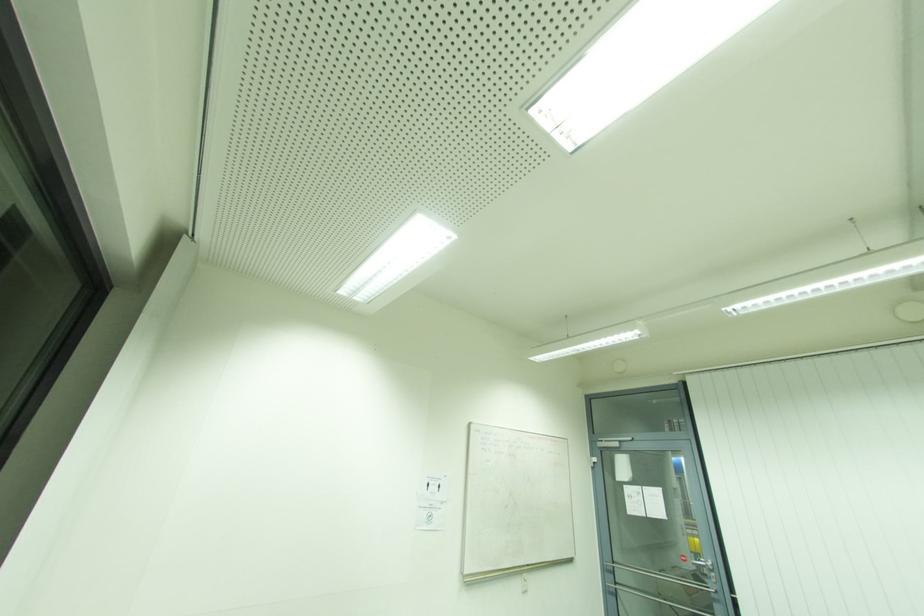
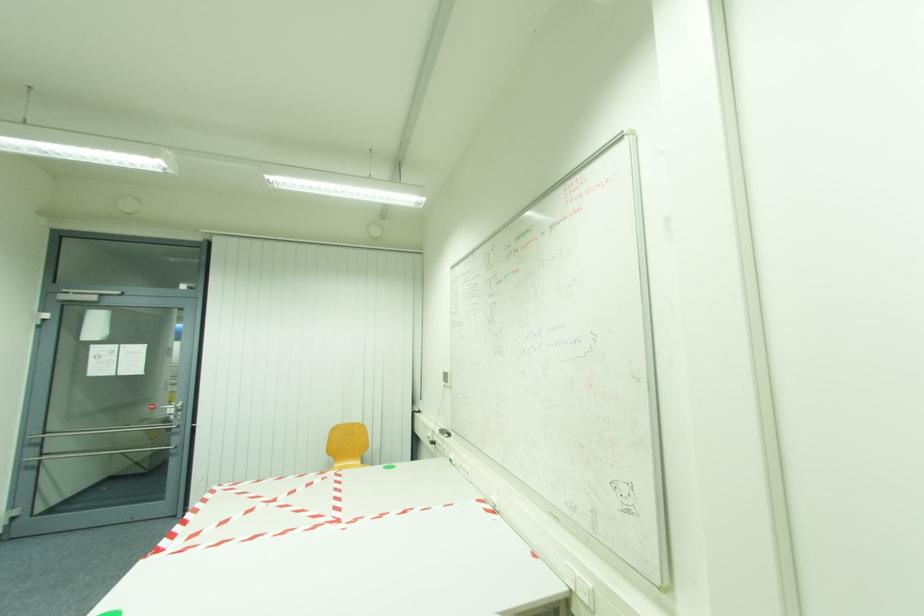
Question: The camera is either moving clockwise (left) or counter-clockwise (right) around the object. The first image is from the beginning of the video and the second image is from the end. Is the camera moving left or right when shooting the video?

Choices:
 (A) Left
 (B) Right

Answer: (A)